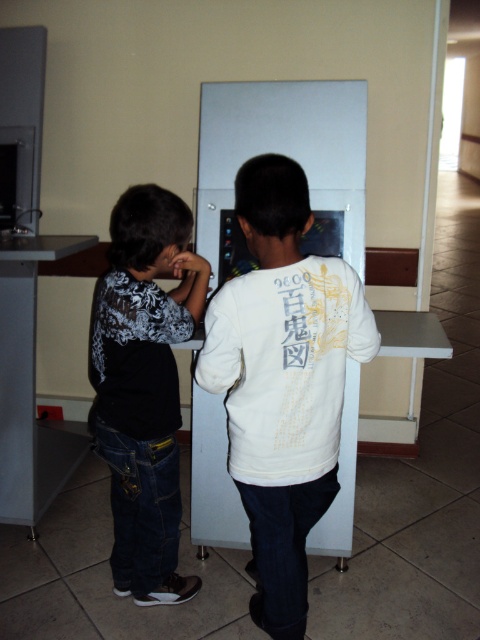
Question: Which of the following is the farthest from the observer?

Choices:
 (A) 245,400
 (B) 122,368

Answer: (B)

Question: Is white matte sweatshirt at center wider than black matte shirt at left?

Choices:
 (A) yes
 (B) no

Answer: (A)

Question: Is white matte sweatshirt at center below black matte shirt at left?

Choices:
 (A) no
 (B) yes

Answer: (B)

Question: Is white matte sweatshirt at center bigger than black matte shirt at left?

Choices:
 (A) yes
 (B) no

Answer: (A)